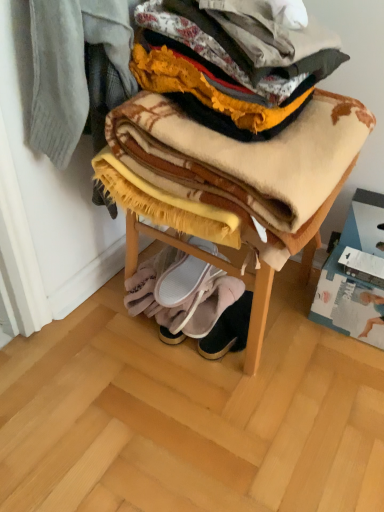
You are a GUI agent. You are given a task and a screenshot of the screen. Output one action in this format:
    pyautogui.click(x=<x>, y=<y>)
    Task: Click on the empty space that is ontop of white suede slippers at lower center, positioned as the first footwear in top-to-bottom order (from a real-world perspective)
    The image size is (384, 512).
    Given the screenshot: What is the action you would take?
    pyautogui.click(x=186, y=270)